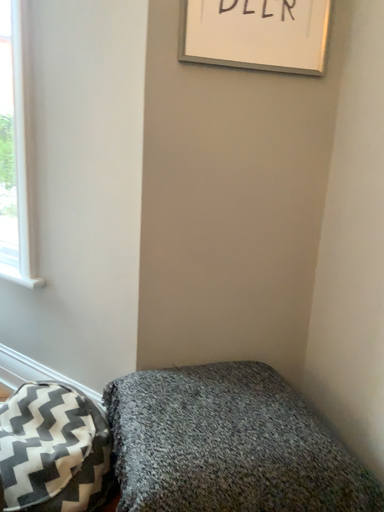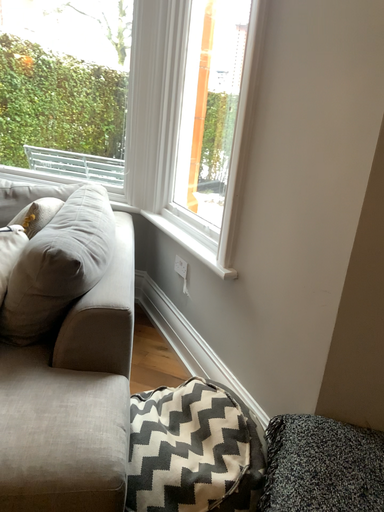
Question: Which way did the camera rotate in the video?

Choices:
 (A) rotated right
 (B) rotated left

Answer: (B)